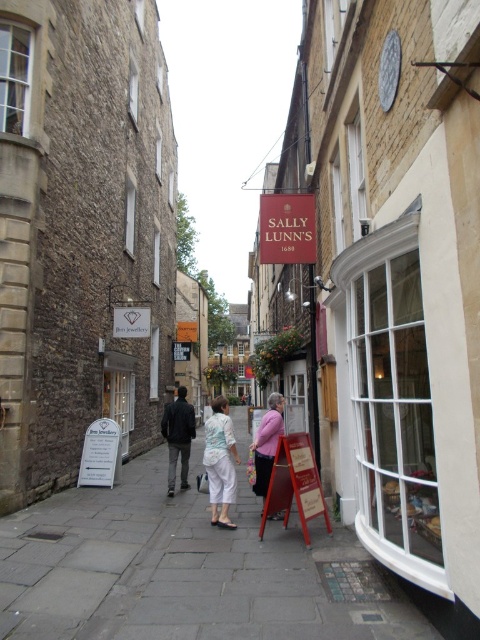
Which is below, white cotton pants at center or pink fabric at center?

Positioned lower is white cotton pants at center.

Is white cotton pants at center further to the viewer compared to pink fabric at center?

No, white cotton pants at center is in front of pink fabric at center.

Does point (217, 480) lie behind point (274, 515)?

No, (217, 480) is closer to viewer.

In order to click on white cotton pants at center in this screenshot , I will do `click(219, 461)`.

Who is shorter, gray stone pavement at center or white cotton pants at center?

gray stone pavement at center is shorter.

Is gray stone pavement at center wider than white cotton pants at center?

Yes.

Is point (205, 531) closer to camera compared to point (230, 525)?

Yes, it is in front of point (230, 525).

The image size is (480, 640). I want to click on gray stone pavement at center, so click(186, 572).

Can you confirm if gray stone pavement at center is wider than light blue fabric blouse at center?

Indeed, gray stone pavement at center has a greater width compared to light blue fabric blouse at center.

Consider the image. Which is more to the left, gray stone pavement at center or light blue fabric blouse at center?

gray stone pavement at center is more to the left.

Which is behind, point (253, 564) or point (228, 506)?

The point (228, 506) is behind.

You are a GUI agent. You are given a task and a screenshot of the screen. Output one action in this format:
    pyautogui.click(x=<x>, y=<y>)
    Task: Click on the gray stone pavement at center
    Image resolution: width=480 pixels, height=640 pixels.
    Given the screenshot: What is the action you would take?
    pyautogui.click(x=186, y=572)